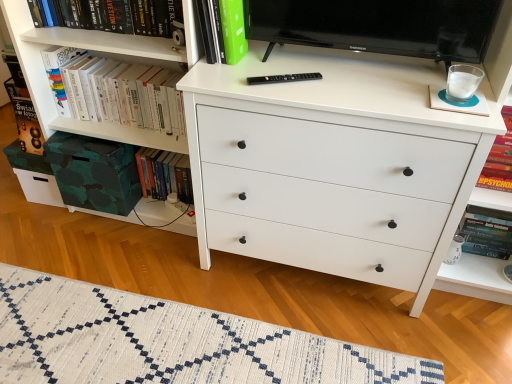
Question: Is hardcover book at lower left, the 2th book when ordered from left to right, inside or outside of hardcover book at right, positioned as the fourth book in left-to-right order?

Choices:
 (A) outside
 (B) inside

Answer: (A)

Question: Considering the positions of hardcover book at lower left, the 3th book in the right-to-left sequence, and hardcover book at right, positioned as the fourth book in left-to-right order, in the image, is hardcover book at lower left, the 3th book in the right-to-left sequence, taller or shorter than hardcover book at right, positioned as the fourth book in left-to-right order,?

Choices:
 (A) short
 (B) tall

Answer: (A)

Question: Estimate the real-world distances between objects in this image. Which object is closer to the hardcover book at right, positioned as the 1th book in right-to-left order?

Choices:
 (A) white paper book at upper left, the fourth book positioned from the right
 (B) hardcover book at lower left, the 2th book when ordered from left to right
 (C) white woven rug at lower center
 (D) white matte chest of drawers at center
 (E) hardcover book at lower right

Answer: (E)

Question: Based on their relative distances, which object is nearer to the white matte chest of drawers at center?

Choices:
 (A) black glossy television at upper center
 (B) white woven rug at lower center
 (C) white paper book at upper left, the fourth book positioned from the right
 (D) hardcover book at right, positioned as the fourth book in left-to-right order
 (E) green matte book at upper center, which ranks as the 2th book in right-to-left order

Answer: (A)